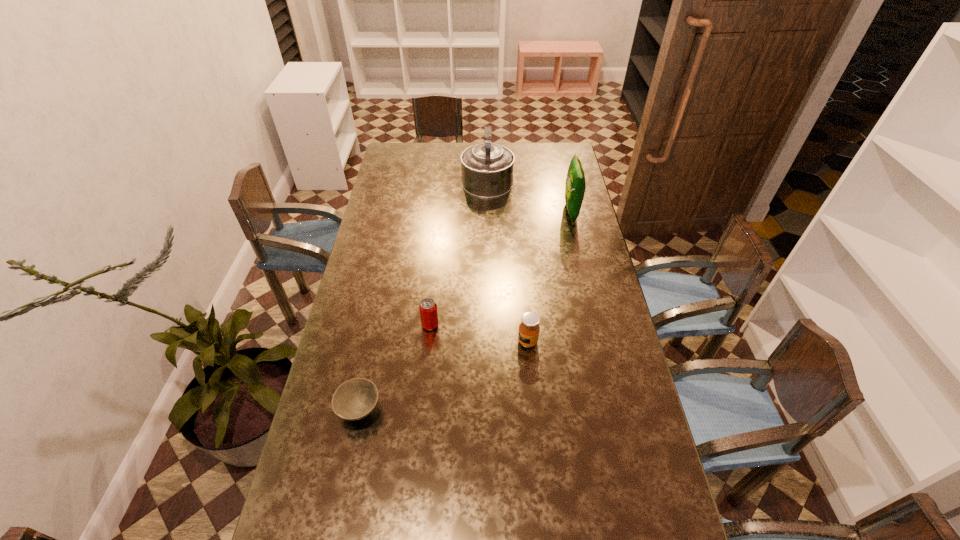
Locate an element on the screen. The width and height of the screenshot is (960, 540). kettle is located at coordinates (487, 169).

At what (x,y) coordinates should I click in order to perform the action: click on the rightmost object. Please return your answer as a coordinate pair (x, y). The image size is (960, 540). Looking at the image, I should click on (575, 186).

Locate an element on the screen. This screenshot has width=960, height=540. the second farthest object is located at coordinates (575, 186).

Find the location of `the fourth farthest object`. the fourth farthest object is located at coordinates (529, 328).

You are a GUI agent. You are given a task and a screenshot of the screen. Output one action in this format:
    pyautogui.click(x=<x>, y=<y>)
    Task: Click on the fourth object from right to left
    
    Given the screenshot: What is the action you would take?
    pyautogui.click(x=428, y=308)

I want to click on the third nearest object, so click(428, 308).

I want to click on the shortest object, so click(355, 399).

Where is `the nearest object`? Image resolution: width=960 pixels, height=540 pixels. the nearest object is located at coordinates (355, 399).

Identify the location of vacant space located with the spout at the front of the kettle. (487, 152).

Locate an element on the screen. free space located with the spout at the front of the kettle is located at coordinates (487, 143).